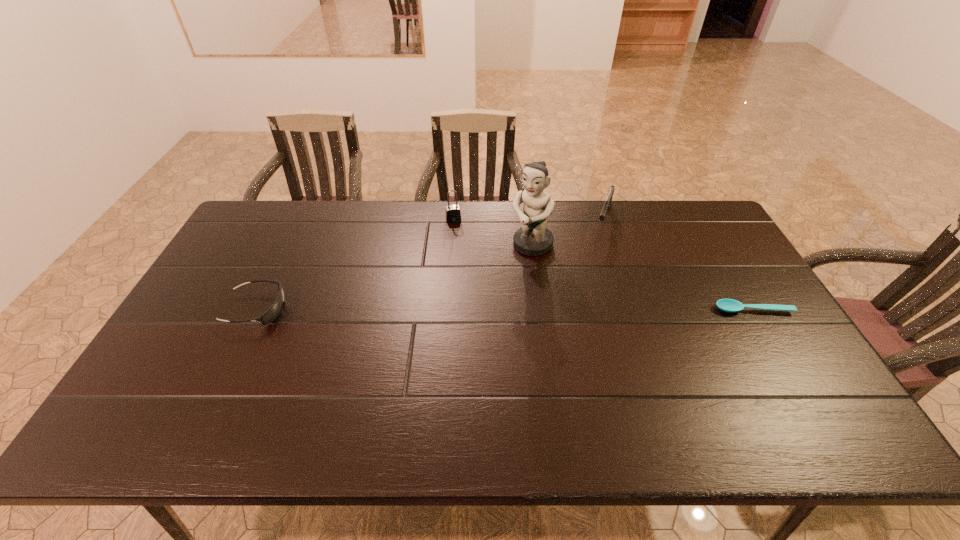
Where is `free space located at the muzzle end of the second object from right to left`? The image size is (960, 540). free space located at the muzzle end of the second object from right to left is located at coordinates (599, 248).

Find the location of `figurine present at the far edge`. figurine present at the far edge is located at coordinates (533, 238).

I want to click on padlock located at the far edge, so click(x=453, y=214).

The image size is (960, 540). I want to click on gun that is positioned at the far edge, so click(x=607, y=203).

In order to click on object present at the left edge in this screenshot , I will do `click(274, 310)`.

Where is `object that is at the right edge`? The width and height of the screenshot is (960, 540). object that is at the right edge is located at coordinates (729, 305).

Locate an element on the screen. free space at the far edge of the desktop is located at coordinates (587, 214).

This screenshot has width=960, height=540. In the image, there is a desktop. What are the coordinates of `vacant space at the near edge` in the screenshot? It's located at (496, 377).

The width and height of the screenshot is (960, 540). I want to click on vacant region at the left edge of the desktop, so click(237, 317).

The height and width of the screenshot is (540, 960). I want to click on vacant space at the right edge of the desktop, so click(765, 318).